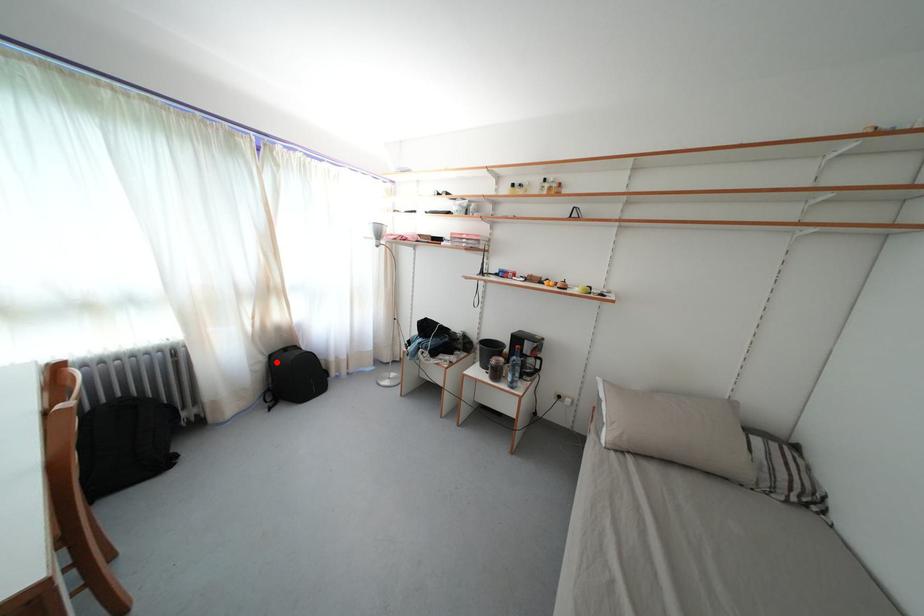
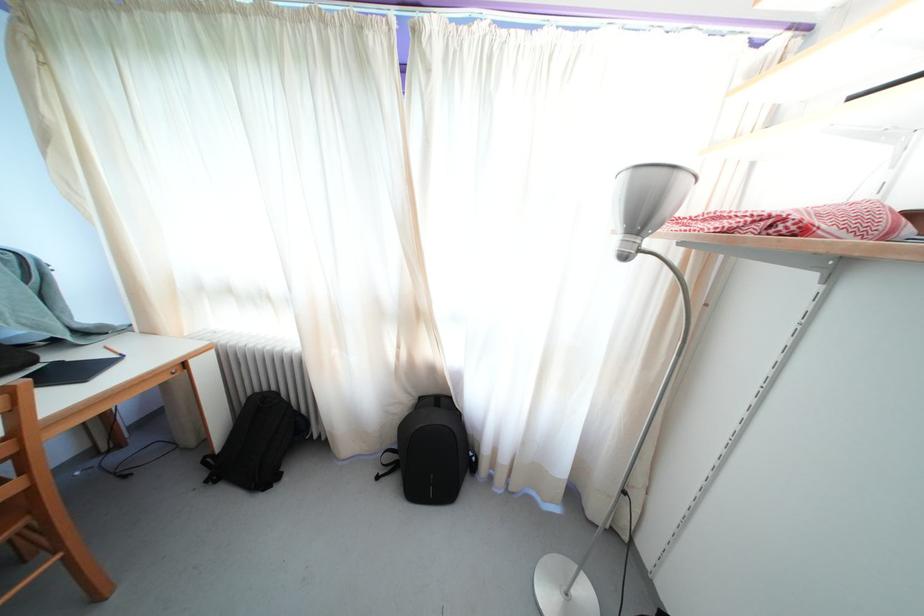
Question: I am providing you with two images of the same scene from different viewpoints. In image1, a red point is highlighted. Considering the same 3D point in image2, which of the following is correct?

Choices:
 (A) It is closer
 (B) It is farther

Answer: (B)